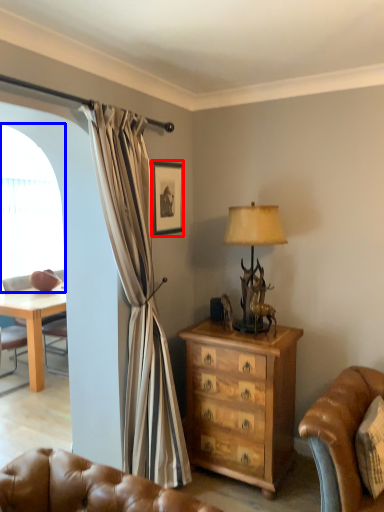
Question: Among these objects, which one is nearest to the camera, picture frame (highlighted by a red box) or window screen (highlighted by a blue box)?

Choices:
 (A) picture frame
 (B) window screen

Answer: (A)